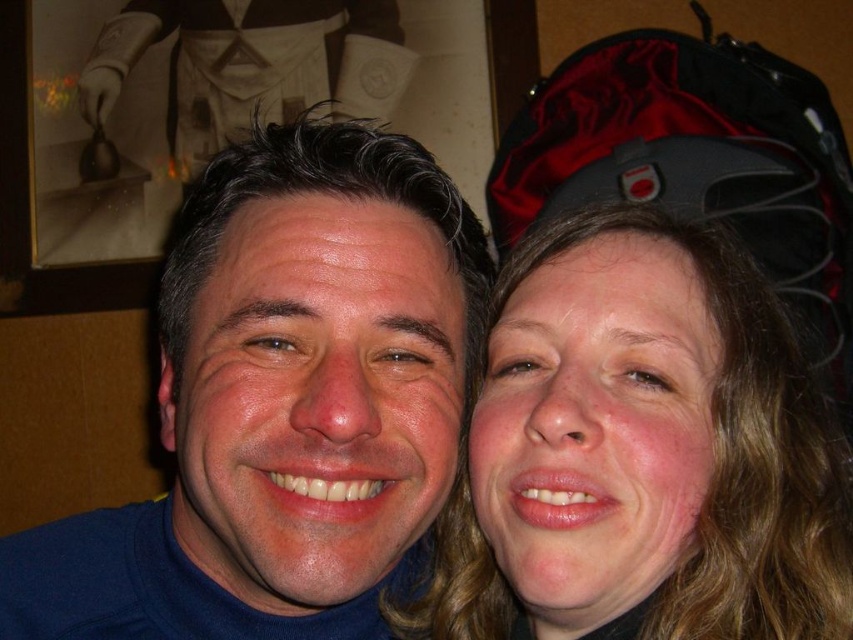
What do you see at coordinates (283, 403) in the screenshot? The image size is (853, 640). I see `blue turtleneck sweater at center` at bounding box center [283, 403].

Which is in front, point (207, 371) or point (682, 506)?

Point (682, 506) is in front.

What do you see at coordinates (283, 403) in the screenshot?
I see `blue turtleneck sweater at center` at bounding box center [283, 403].

The image size is (853, 640). I want to click on blue turtleneck sweater at center, so click(x=283, y=403).

Describe the element at coordinates (283, 403) in the screenshot. I see `blue turtleneck sweater at center` at that location.

You are a GUI agent. You are given a task and a screenshot of the screen. Output one action in this format:
    pyautogui.click(x=<x>, y=<y>)
    Task: Click on the blue turtleneck sweater at center
    
    Given the screenshot: What is the action you would take?
    pyautogui.click(x=283, y=403)

Locate an element on the screen. The image size is (853, 640). blue turtleneck sweater at center is located at coordinates (283, 403).

In the scene shown: Which is more to the right, smooth skin face at right or white cloth at upper center?

smooth skin face at right

Does smooth skin face at right come behind white cloth at upper center?

That is False.

Between point (807, 522) and point (281, 16), which one is positioned behind?

Positioned behind is point (281, 16).

The image size is (853, 640). I want to click on smooth skin face at right, so click(646, 451).